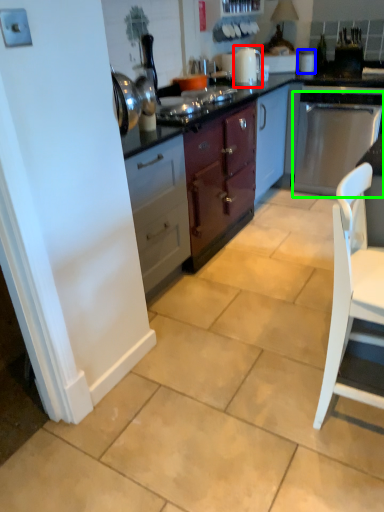
Question: Based on their relative distances, which object is farther from kitchen appliance (highlighted by a red box)? Choose from appliance (highlighted by a blue box) and kitchen appliance (highlighted by a green box).

Choices:
 (A) appliance
 (B) kitchen appliance

Answer: (B)